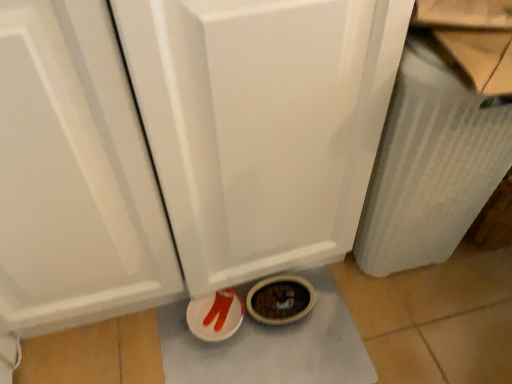
Image resolution: width=512 pixels, height=384 pixels. What are the coordinates of `white textured bath mat at lower center` in the screenshot? It's located at (271, 346).

Measure the distance between matte plastic shoes at lower center and camera.

matte plastic shoes at lower center and camera are 38.07 inches apart.

This screenshot has width=512, height=384. In order to click on white textured radiator at right in this screenshot , I will do `click(430, 166)`.

Is white textured radiator at right aimed at white textured bath mat at lower center?

No, white textured radiator at right is not aimed at white textured bath mat at lower center.

Are white textured radiator at right and white textured bath mat at lower center located far from each other?

No.

Based on the photo, visually, is white textured radiator at right positioned to the left or to the right of white textured bath mat at lower center?

white textured radiator at right is positioned on white textured bath mat at lower center's right side.

From a real-world perspective, is matte plastic shoes at lower center under white textured radiator at right?

Correct, in the physical world, matte plastic shoes at lower center is lower than white textured radiator at right.

Can you tell me how much matte plastic shoes at lower center and white textured radiator at right differ in facing direction?

The facing directions of matte plastic shoes at lower center and white textured radiator at right are 0.537 degrees apart.

In the scene shown: Considering the sizes of objects matte plastic shoes at lower center and white textured radiator at right in the image provided, who is shorter, matte plastic shoes at lower center or white textured radiator at right?

matte plastic shoes at lower center is shorter.

Looking at this image, which is correct: matte plastic shoes at lower center is inside white textured radiator at right, or outside of it?

matte plastic shoes at lower center lies outside white textured radiator at right.

From the picture: Can you confirm if white textured bath mat at lower center is positioned to the left of white textured radiator at right?

Correct, you'll find white textured bath mat at lower center to the left of white textured radiator at right.

From a real-world perspective, which object stands above the other?

white textured radiator at right.

Which is behind, point (205, 353) or point (367, 250)?

Point (367, 250)

Which is farther, (320, 364) or (216, 319)?

The point (216, 319) is farther.

Which of these two, white textured bath mat at lower center or matte plastic shoes at lower center, is thinner?

matte plastic shoes at lower center.

Based on their positions, is white textured bath mat at lower center located to the left or right of matte plastic shoes at lower center?

white textured bath mat at lower center is positioned on matte plastic shoes at lower center's right side.

Are white textured bath mat at lower center and matte plastic shoes at lower center beside each other?

No, white textured bath mat at lower center is not beside matte plastic shoes at lower center.

Does matte plastic shoes at lower center contain white textured bath mat at lower center?

No.

Is matte plastic shoes at lower center to the left or to the right of white textured bath mat at lower center in the image?

From the image, it's evident that matte plastic shoes at lower center is to the left of white textured bath mat at lower center.

Between point (195, 309) and point (168, 332), which one is positioned behind?

Point (168, 332)

The width and height of the screenshot is (512, 384). In order to click on footwear to the left of white textured bath mat at lower center in this screenshot , I will do `click(215, 315)`.

Is white textured radiator at right placed right next to matte plastic shoes at lower center?

No.

Is white textured radiator at right shorter than matte plastic shoes at lower center?

No, white textured radiator at right is not shorter than matte plastic shoes at lower center.

Does white textured radiator at right come behind matte plastic shoes at lower center?

No, it is not.

You are a GUI agent. You are given a task and a screenshot of the screen. Output one action in this format:
    pyautogui.click(x=<x>, y=<y>)
    Task: Click on the bath mat below the white textured radiator at right (from a real-world perspective)
    This screenshot has height=384, width=512.
    Given the screenshot: What is the action you would take?
    pyautogui.click(x=271, y=346)

This screenshot has height=384, width=512. In order to click on footwear lying below the white textured radiator at right (from the image's perspective) in this screenshot , I will do `click(215, 315)`.

From the image, which object appears to be farther from white textured radiator at right, matte plastic shoes at lower center or white textured bath mat at lower center?

matte plastic shoes at lower center.

Looking at the image, which one is located further to white textured bath mat at lower center, white textured radiator at right or matte plastic shoes at lower center?

white textured radiator at right is positioned further to the anchor white textured bath mat at lower center.

Looking at the image, which one is located closer to matte plastic shoes at lower center, white textured bath mat at lower center or white textured radiator at right?

The object closer to matte plastic shoes at lower center is white textured bath mat at lower center.

Which object lies nearer to the anchor point matte plastic shoes at lower center, white textured radiator at right or white textured bath mat at lower center?

Based on the image, white textured bath mat at lower center appears to be nearer to matte plastic shoes at lower center.

Based on the photo, based on their spatial positions, is white textured bath mat at lower center or matte plastic shoes at lower center closer to white textured radiator at right?

Among the two, white textured bath mat at lower center is located nearer to white textured radiator at right.

Which object lies further to the anchor point white textured bath mat at lower center, matte plastic shoes at lower center or white textured radiator at right?

white textured radiator at right lies further to white textured bath mat at lower center than the other object.

Locate an element on the screen. The width and height of the screenshot is (512, 384). bath mat situated between matte plastic shoes at lower center and white textured radiator at right from left to right is located at coordinates (271, 346).